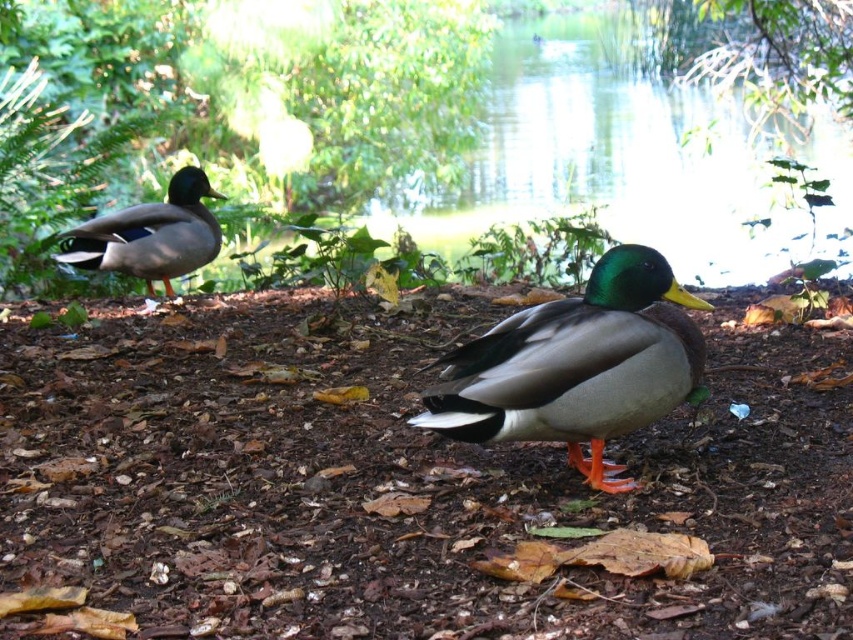
Does point (575, 422) come farther from viewer compared to point (148, 241)?

No, (575, 422) is closer to viewer.

Between green glossy duck at center and shiny green duck at left, which one has less height?

shiny green duck at left

Between point (650, 368) and point (144, 232), which one is positioned in front?

Point (650, 368) is more forward.

Identify the location of green glossy duck at center. This screenshot has height=640, width=853. (576, 365).